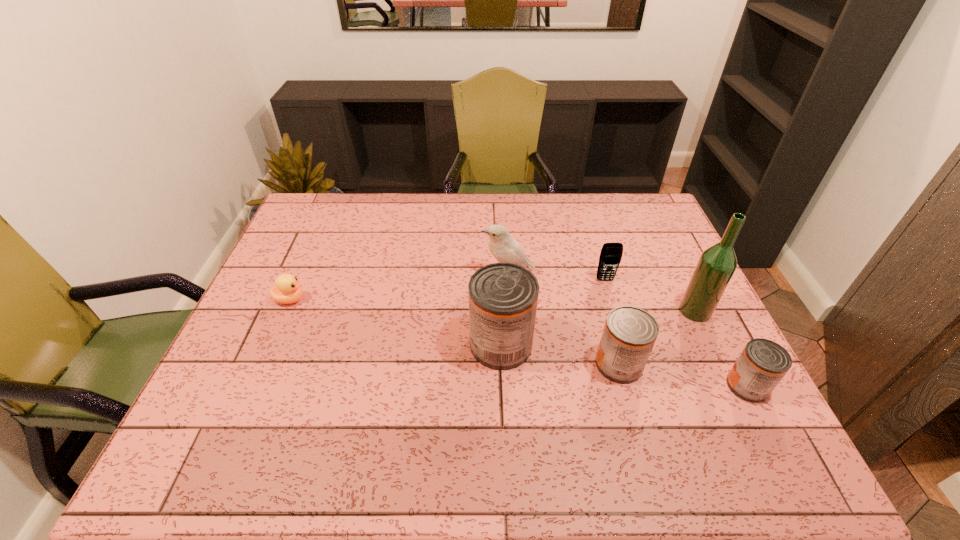
Locate an element on the screen. The height and width of the screenshot is (540, 960). the tallest can is located at coordinates (503, 297).

I want to click on the second tallest can, so click(x=629, y=334).

Locate an element on the screen. Image resolution: width=960 pixels, height=540 pixels. the shortest can is located at coordinates (762, 364).

Image resolution: width=960 pixels, height=540 pixels. I want to click on cellular telephone, so click(611, 254).

Find the location of `the third tallest object`. the third tallest object is located at coordinates (502, 245).

You are a GUI agent. You are given a task and a screenshot of the screen. Output one action in this format:
    pyautogui.click(x=<x>, y=<y>)
    Task: Click on the alcohol
    The width and height of the screenshot is (960, 540).
    Given the screenshot: What is the action you would take?
    pyautogui.click(x=717, y=264)

Locate an element on the screen. the leftmost object is located at coordinates (287, 290).

Where is `duckling`? duckling is located at coordinates (287, 290).

Locate an element on the screen. The image size is (960, 540). vacant space located on the back of the tallest can is located at coordinates (496, 232).

Find the location of a particular element. vacant space situated on the back of the second can from left to right is located at coordinates coord(608,322).